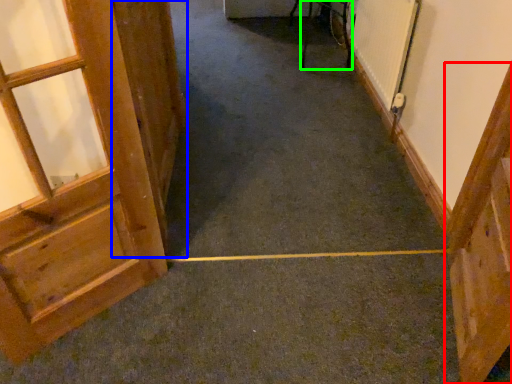
Question: Which is nearer to the door (highlighted by a red box)? door (highlighted by a blue box) or furniture (highlighted by a green box).

Choices:
 (A) door
 (B) furniture

Answer: (A)